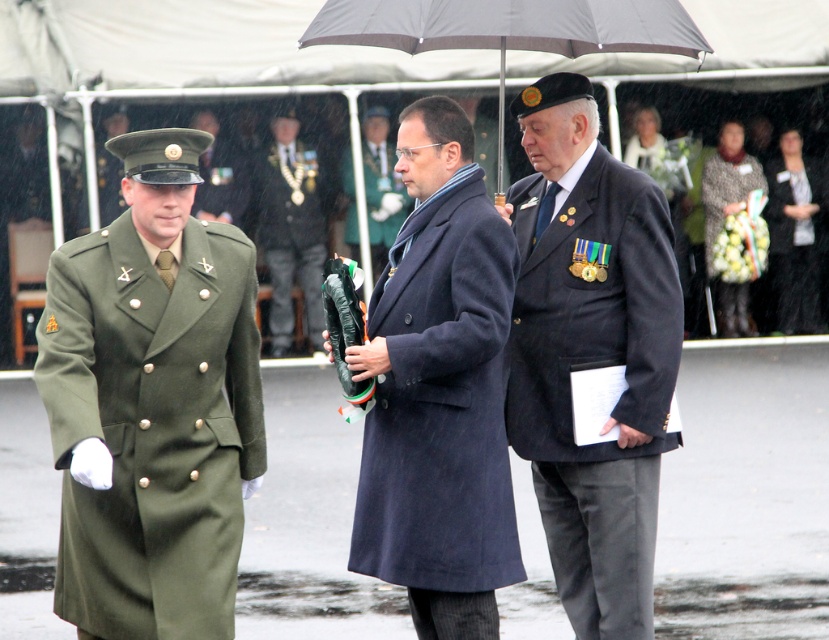
Looking at this image, based on the provided scene description, where is the matte green coat at center located in terms of its 2D coordinates?

The matte green coat at center is located at the 2D coordinates point [381,186].

You are a photographer at the event and need to capture a group photo of the matte green coat at center and the green matte uniform at left. The camera frame can only accommodate objects with a combined width of 1.5 meters. Given the width difference, will both fit within the frame?

The matte green coat at center has a larger width than the green matte uniform at left. Since the camera frame can only accommodate 1.5 meters combined width, it depends on their individual widths. However, the description only states the relative size, not exact measurements. Without specific dimensions, we cannot confirm if they will fit together.